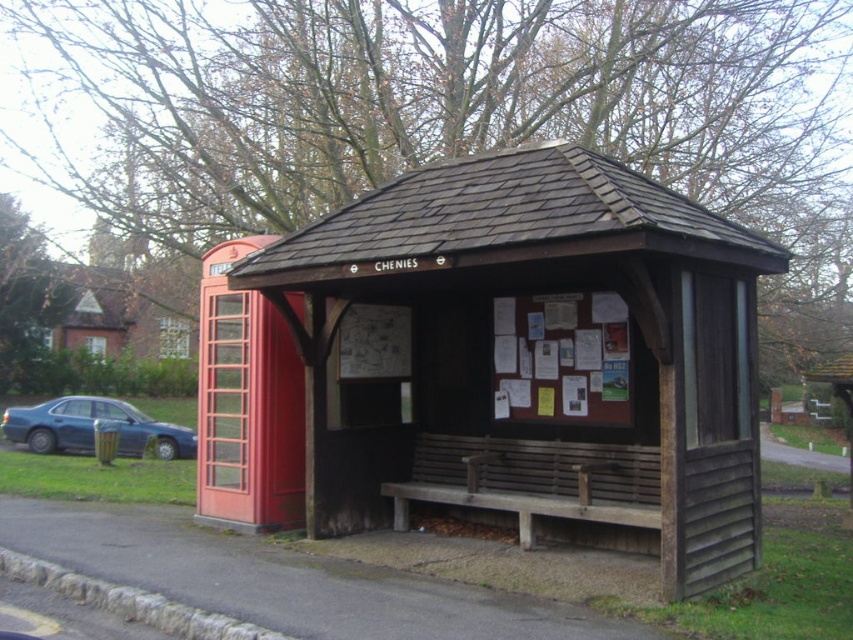
Question: Which point is farther from the camera taking this photo?

Choices:
 (A) (608, 326)
 (B) (494, 444)
 (C) (189, 436)

Answer: (C)

Question: Which point is farther to the camera?

Choices:
 (A) weathered wood bench at center
 (B) wooden bench at center
 (C) matte blue sedan at left

Answer: (C)

Question: Does wooden bench at center have a greater width compared to weathered wood bench at center?

Choices:
 (A) yes
 (B) no

Answer: (A)

Question: Is wooden bench at center smaller than weathered wood bench at center?

Choices:
 (A) no
 (B) yes

Answer: (A)

Question: Which is nearer to the wooden bench at center?

Choices:
 (A) matte blue sedan at left
 (B) weathered wood bench at center

Answer: (B)

Question: Is wooden bench at center wider than matte blue sedan at left?

Choices:
 (A) no
 (B) yes

Answer: (A)